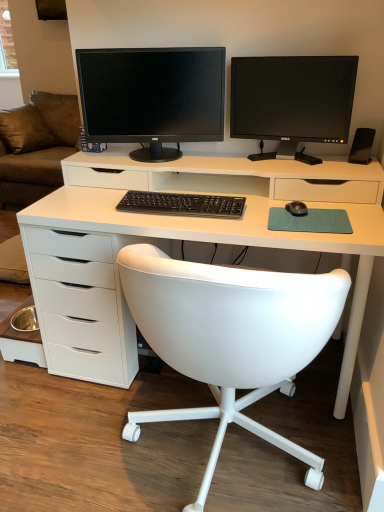
Question: Should I look upward or downward to see brown fabric couch at left?

Choices:
 (A) down
 (B) up

Answer: (B)

Question: Does black glossy monitor at upper center, the 2th computer monitor in the right-to-left sequence, appear on the left side of black glossy monitor at upper right, which is counted as the second computer monitor, starting from the left?

Choices:
 (A) no
 (B) yes

Answer: (B)

Question: From a real-world perspective, is black glossy monitor at upper center, the 2th computer monitor in the right-to-left sequence, located beneath black glossy monitor at upper right, which is counted as the 1th computer monitor, starting from the right?

Choices:
 (A) no
 (B) yes

Answer: (A)

Question: Is the surface of black glossy monitor at upper center, which is the first computer monitor in left-to-right order, in direct contact with black glossy monitor at upper right, which is counted as the 1th computer monitor, starting from the right?

Choices:
 (A) yes
 (B) no

Answer: (B)

Question: Considering the relative sizes of black glossy monitor at upper center, which is the first computer monitor in left-to-right order, and black glossy monitor at upper right, which is counted as the 1th computer monitor, starting from the right, in the image provided, is black glossy monitor at upper center, which is the first computer monitor in left-to-right order, shorter than black glossy monitor at upper right, which is counted as the 1th computer monitor, starting from the right,?

Choices:
 (A) no
 (B) yes

Answer: (A)

Question: Does black glossy monitor at upper center, the 2th computer monitor in the right-to-left sequence, have a greater width compared to black glossy monitor at upper right, which is counted as the second computer monitor, starting from the left?

Choices:
 (A) no
 (B) yes

Answer: (B)

Question: Is black glossy monitor at upper center, which is the first computer monitor in left-to-right order, not within black glossy monitor at upper right, which is counted as the second computer monitor, starting from the left?

Choices:
 (A) no
 (B) yes

Answer: (B)

Question: Does black plastic keyboard at center appear on the right side of black glossy monitor at upper center, the 2th computer monitor in the right-to-left sequence?

Choices:
 (A) yes
 (B) no

Answer: (A)

Question: Does black plastic keyboard at center have a larger size compared to black glossy monitor at upper center, the 2th computer monitor in the right-to-left sequence?

Choices:
 (A) no
 (B) yes

Answer: (A)

Question: From the image's perspective, is black plastic keyboard at center under black glossy monitor at upper center, which is the first computer monitor in left-to-right order?

Choices:
 (A) yes
 (B) no

Answer: (A)

Question: From a real-world perspective, is black plastic keyboard at center over black glossy monitor at upper center, the 2th computer monitor in the right-to-left sequence?

Choices:
 (A) yes
 (B) no

Answer: (B)

Question: Is black plastic keyboard at center thinner than black glossy monitor at upper center, the 2th computer monitor in the right-to-left sequence?

Choices:
 (A) no
 (B) yes

Answer: (B)

Question: Is black plastic keyboard at center far away from black glossy monitor at upper center, which is the first computer monitor in left-to-right order?

Choices:
 (A) no
 (B) yes

Answer: (A)

Question: From the image's perspective, is black plastic speaker at right above white leather chair at center?

Choices:
 (A) yes
 (B) no

Answer: (A)